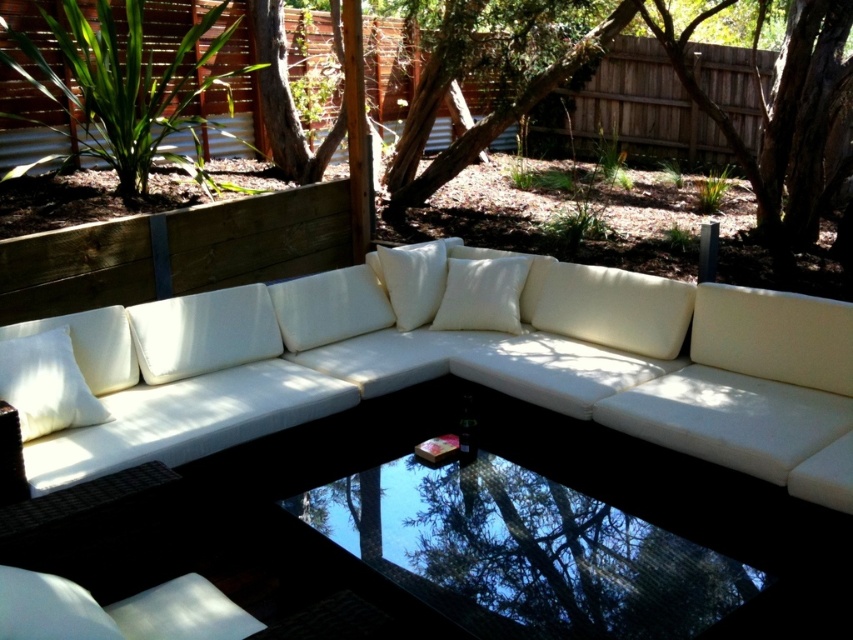
From the picture: You are sitting on the white soft cushion at center and want to place your drink on the nearest surface. Can you put it on the transparent glass table at center without it being too high?

The transparent glass table at center is not as tall as the white soft cushion at center, so the table is lower. Therefore, you can comfortably place your drink on the transparent glass table at center without it being too high.

You are planning to place a decorative vase on the transparent glass table at center. Considering the height of the table and the white matte pillow at left, will the vase be stable?

The transparent glass table at center has a lesser height compared to white matte pillow at left, so the vase may not be stable if the table is too low. Ensure the table provides a sturdy base before placing the vase.

You are a delivery person carrying a package that is 1.5 meters long. You need to place it between the transparent glass table at center and the white fabric pillow at center. Is there enough space to fit the package between them?

The distance between the transparent glass table at center and the white fabric pillow at center is 1.36 meters. Since the package is 1.5 meters long, it is longer than the available space, so the package cannot fit between them.